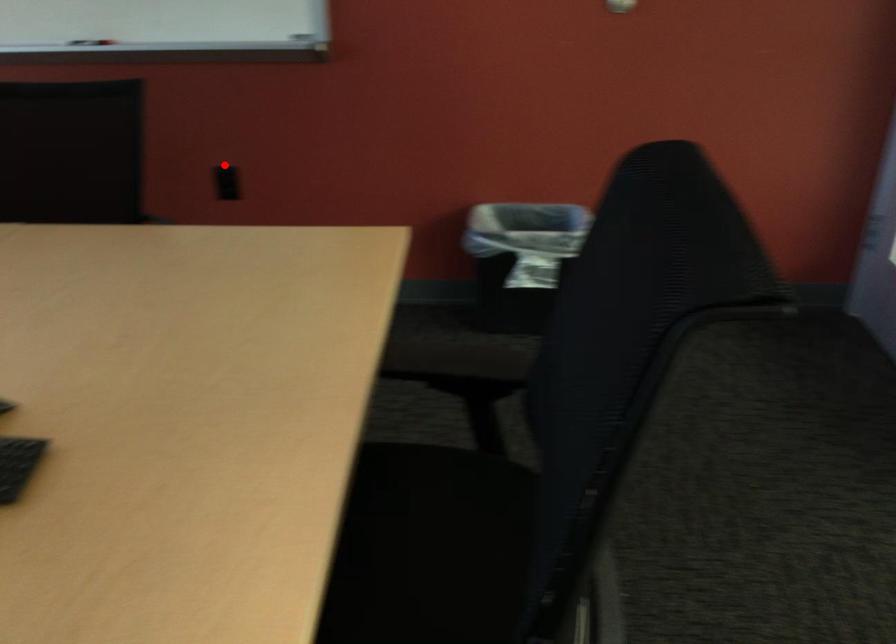
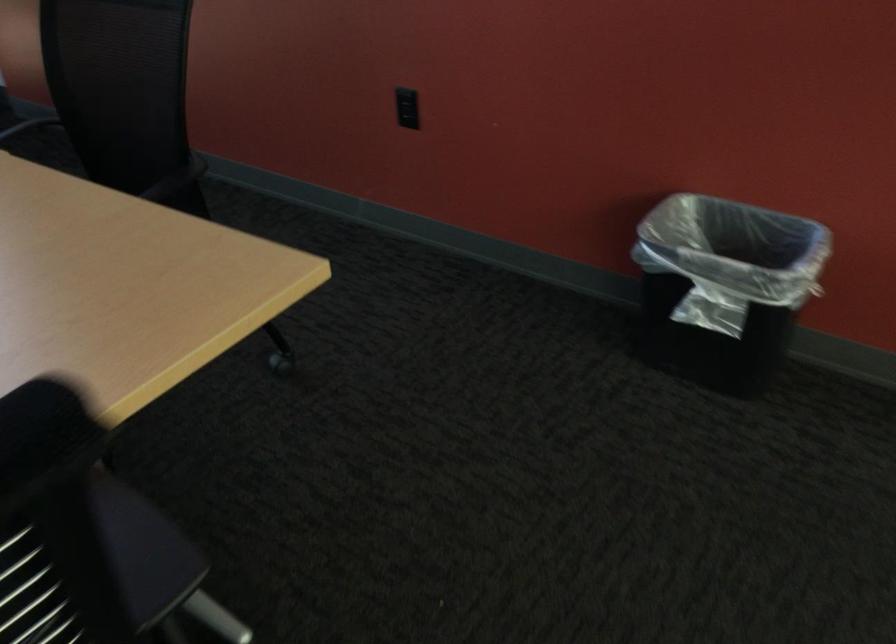
Question: I am providing you with two images of the same scene from different viewpoints. In image1, a red point is highlighted. Considering the same 3D point in image2, which of the following is correct?

Choices:
 (A) It is closer
 (B) It is farther

Answer: (A)